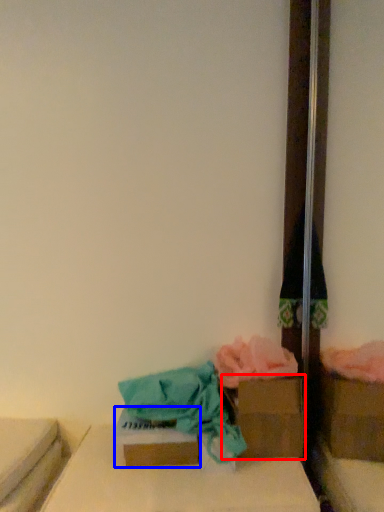
Question: Which point is closer to the camera, storage box (highlighted by a red box) or storage box (highlighted by a blue box)?

Choices:
 (A) storage box
 (B) storage box

Answer: (B)